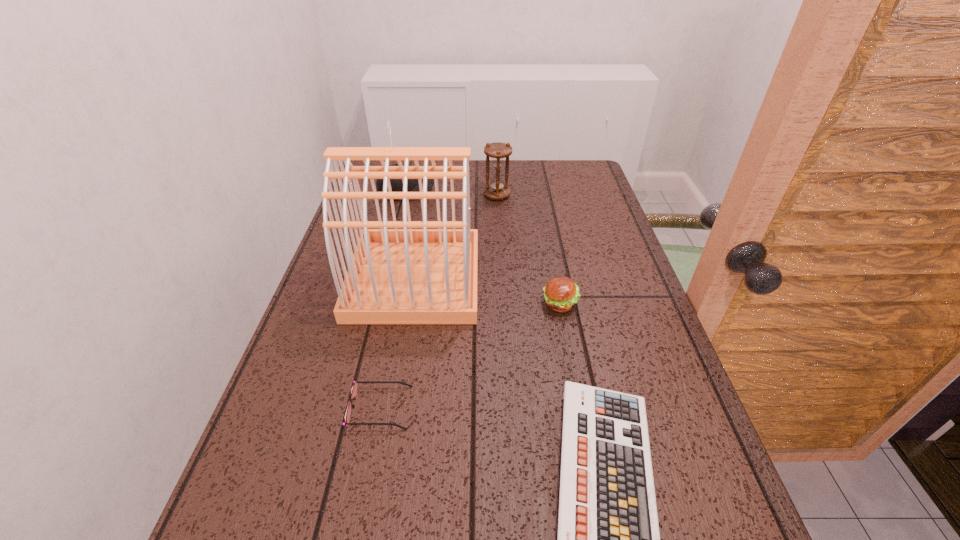
You are a GUI agent. You are given a task and a screenshot of the screen. Output one action in this format:
    pyautogui.click(x=<x>, y=<y>)
    Task: Click on the free spot located on the bridge of the sunglasses
    The image size is (960, 540).
    Given the screenshot: What is the action you would take?
    point(496,408)

You are a GUI agent. You are given a task and a screenshot of the screen. Output one action in this format:
    pyautogui.click(x=<x>, y=<y>)
    Task: Click on the hourglass that is positioned at the far edge
    
    Given the screenshot: What is the action you would take?
    pyautogui.click(x=497, y=189)

This screenshot has width=960, height=540. I want to click on baseball cap that is at the far edge, so click(396, 184).

The image size is (960, 540). In order to click on birdcage that is positioned at the left edge in this screenshot , I will do `click(396, 276)`.

Locate an element on the screen. This screenshot has height=540, width=960. baseball cap present at the left edge is located at coordinates 396,184.

Find the location of a particular element. The width and height of the screenshot is (960, 540). sunglasses that is at the left edge is located at coordinates (354, 389).

Identify the location of object that is at the far left corner. (396, 184).

Image resolution: width=960 pixels, height=540 pixels. Find the location of `free space at the left edge of the desktop`. free space at the left edge of the desktop is located at coordinates (390, 206).

Locate an element on the screen. vacant region at the right edge of the desktop is located at coordinates (567, 217).

At what (x,y) coordinates should I click in order to perform the action: click on free space between the tallest object and the hamburger. Please return your answer as a coordinate pair (x, y). This screenshot has height=540, width=960. Looking at the image, I should click on (488, 291).